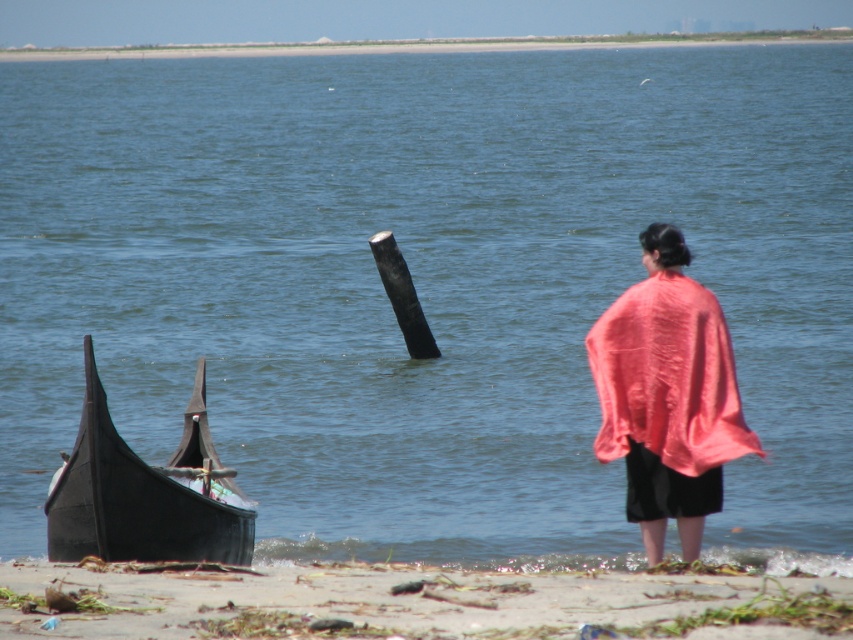
Which is above, pink fabric at right or black polished wood boat at lower left?

pink fabric at right is above.

I want to click on pink fabric at right, so click(666, 396).

Is sandy beach at lower left behind pink fabric at right?

No, it is in front of pink fabric at right.

Between sandy beach at lower left and pink fabric at right, which one is positioned lower?

Positioned lower is sandy beach at lower left.

Who is more forward, (x=766, y=620) or (x=668, y=358)?

Point (x=766, y=620) is in front.

Identify the location of sandy beach at lower left. The image size is (853, 640). (412, 604).

Does sandy beach at lower left have a greater width compared to black polished wood boat at lower left?

Correct, the width of sandy beach at lower left exceeds that of black polished wood boat at lower left.

In the scene shown: Does sandy beach at lower left appear on the left side of black polished wood boat at lower left?

No, sandy beach at lower left is not to the left of black polished wood boat at lower left.

What do you see at coordinates (412, 604) in the screenshot? I see `sandy beach at lower left` at bounding box center [412, 604].

This screenshot has width=853, height=640. In order to click on sandy beach at lower left in this screenshot , I will do `click(412, 604)`.